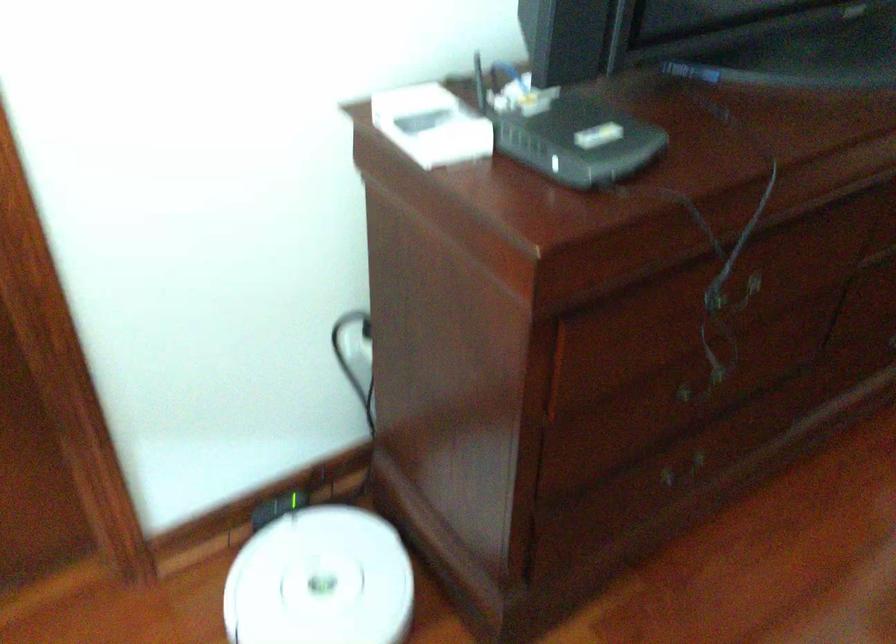
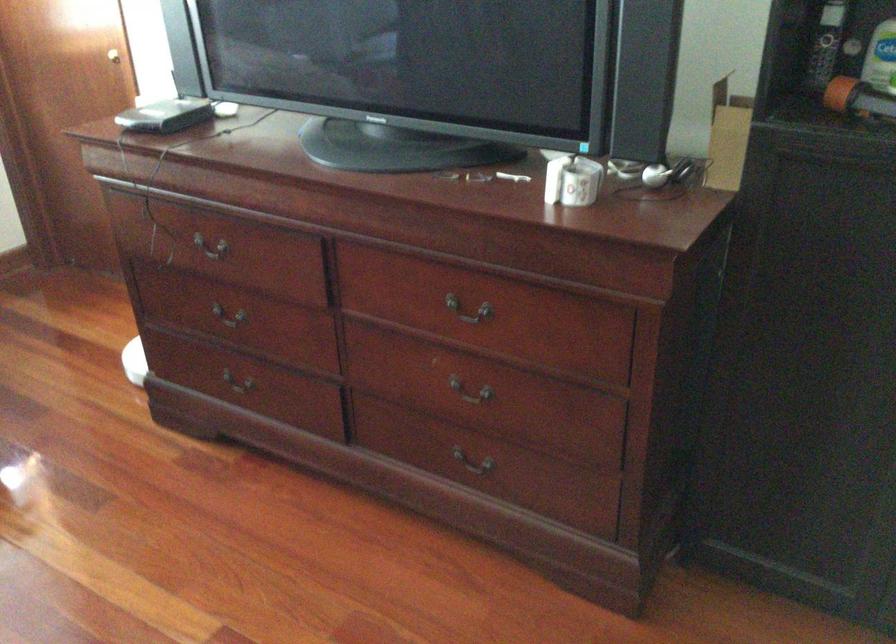
In the second image, find the point that corresponds to pixel 655 285 in the first image.

(211, 241)